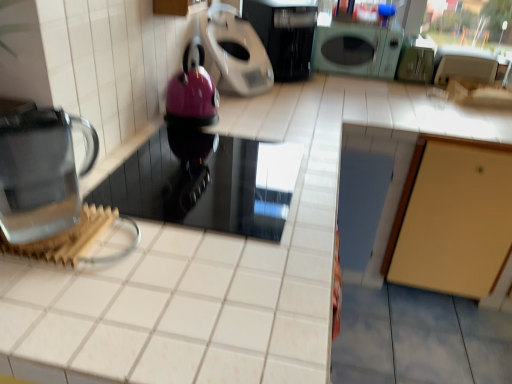
Where is `vacant space underneath transparent glass kettle at left (from a real-world perspective)`? Image resolution: width=512 pixels, height=384 pixels. vacant space underneath transparent glass kettle at left (from a real-world perspective) is located at coordinates (52, 229).